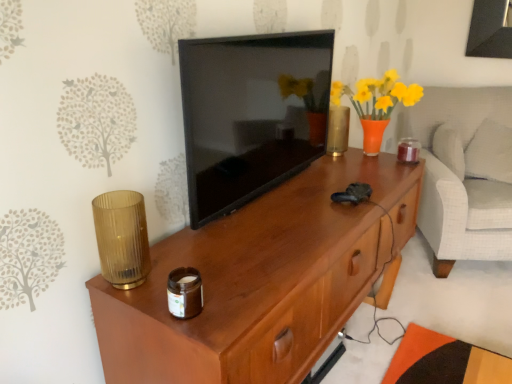
Question: Is point (134, 281) positioned closer to the camera than point (400, 142)?

Choices:
 (A) closer
 (B) farther

Answer: (A)

Question: In terms of width, does amber ribbed glass at left, which ranks as the third candle holder in right-to-left order, look wider or thinner when compared to translucent amber glass candle at right, the 3th candle holder viewed from the left?

Choices:
 (A) wide
 (B) thin

Answer: (B)

Question: Which is nearer to the white fabric armchair at right?

Choices:
 (A) white soft pillow at right
 (B) brown glass jar at lower center, the 3th candle holder positioned from the back
 (C) amber ribbed glass at left, which ranks as the third candle holder in right-to-left order
 (D) black glossy tv at center
 (E) wooden desk at center

Answer: (A)

Question: Which is nearer to the white fabric armchair at right?

Choices:
 (A) brown glass jar at lower center, the 3th candle holder positioned from the back
 (B) translucent amber glass candle at right, acting as the third candle holder starting from the front
 (C) black glossy tv at center
 (D) white soft pillow at right
 (E) amber ribbed glass at left, the 2th candle holder in the front-to-back sequence

Answer: (D)